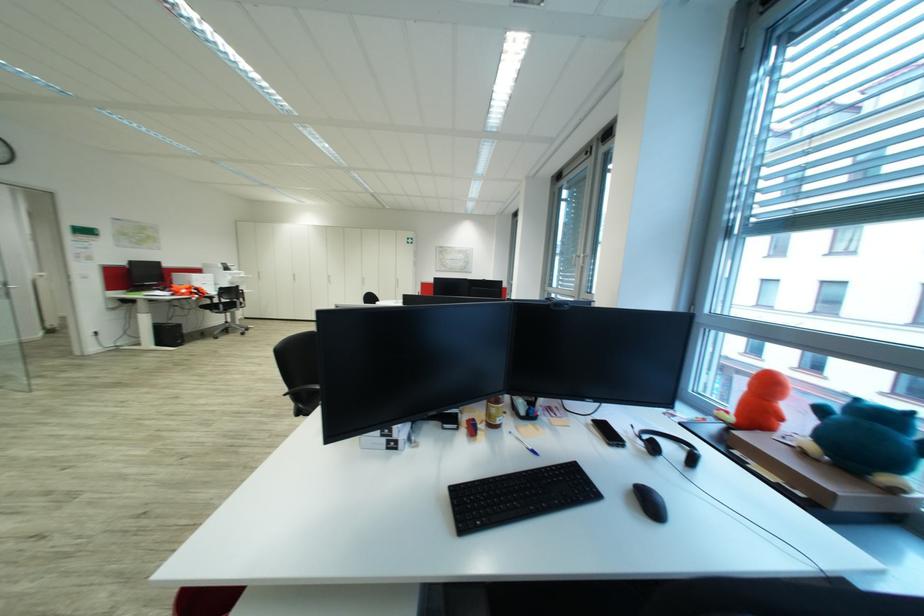
Locate an element on the screen. silver window handle is located at coordinates (575, 260).